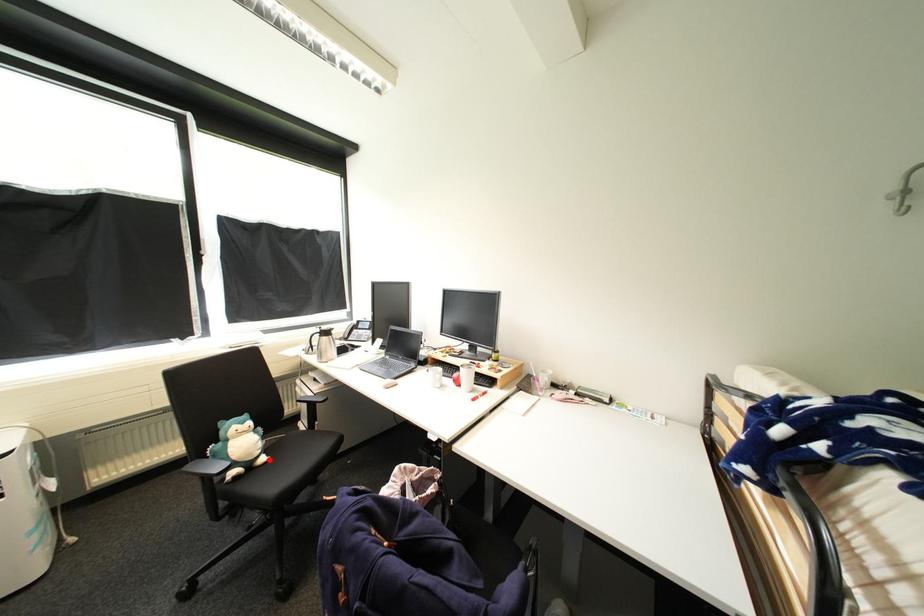
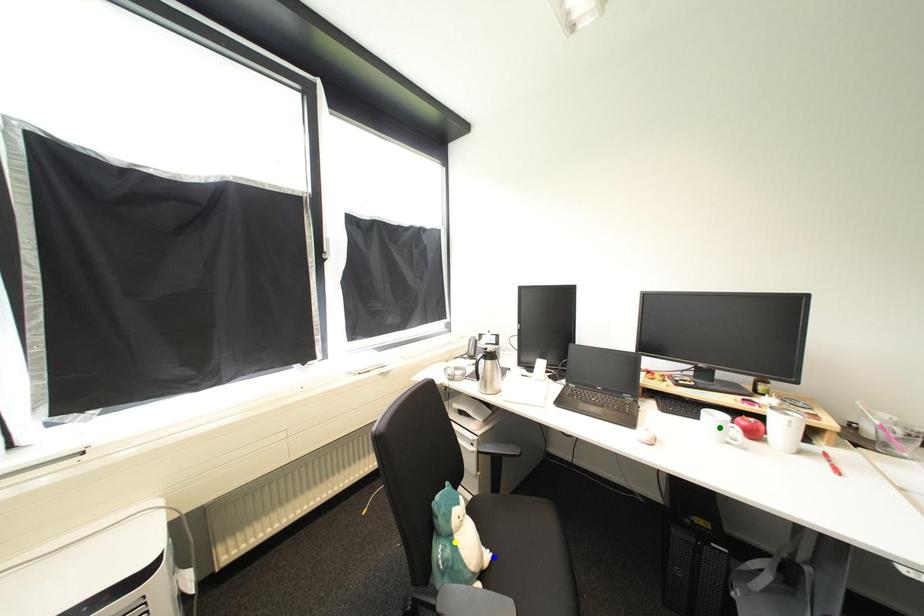
Question: I am providing you with two images of the same scene from different viewpoints. A red point is marked on the first image. You are given multiple points on the second image. Which spot in image 2 lines up with the point in image 1?

Choices:
 (A) green point
 (B) blue point
 (C) yellow point

Answer: (B)